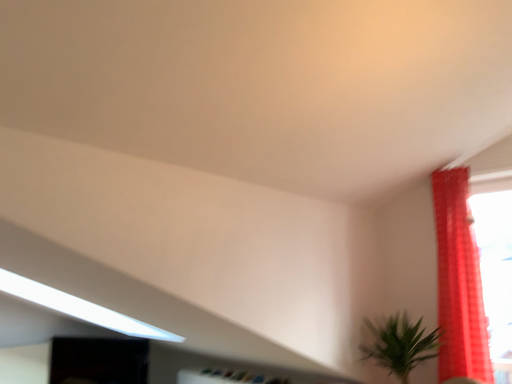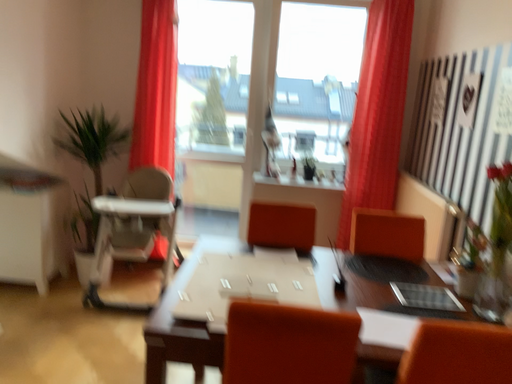
Question: Which way did the camera rotate in the video?

Choices:
 (A) rotated right
 (B) rotated left

Answer: (A)